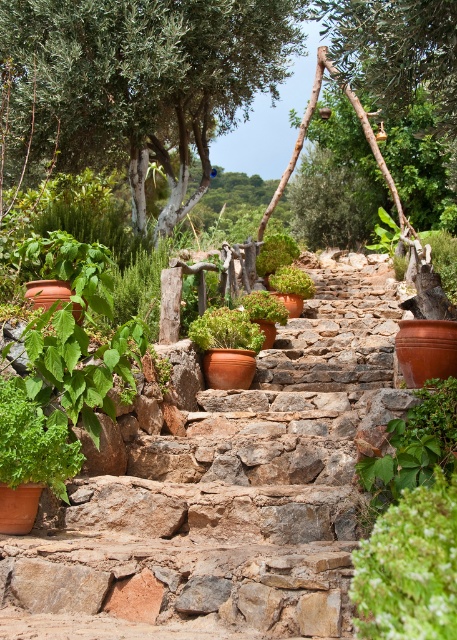
Question: Is terracotta stone stairs at center behind green leafy tree at upper center?

Choices:
 (A) yes
 (B) no

Answer: (B)

Question: Which point is closer to the camera?

Choices:
 (A) green leafy tree at upper center
 (B) terracotta stone stairs at center

Answer: (B)

Question: In this image, where is terracotta stone stairs at center located relative to green leafy tree at upper center?

Choices:
 (A) left
 (B) right

Answer: (B)

Question: Considering the relative positions of terracotta stone stairs at center and green leafy tree at upper center in the image provided, where is terracotta stone stairs at center located with respect to green leafy tree at upper center?

Choices:
 (A) left
 (B) right

Answer: (B)

Question: Which point is closer to the camera taking this photo?

Choices:
 (A) (35, 593)
 (B) (187, 166)

Answer: (A)

Question: Which object is farther from the camera taking this photo?

Choices:
 (A) terracotta stone stairs at center
 (B) green leafy tree at upper center

Answer: (B)